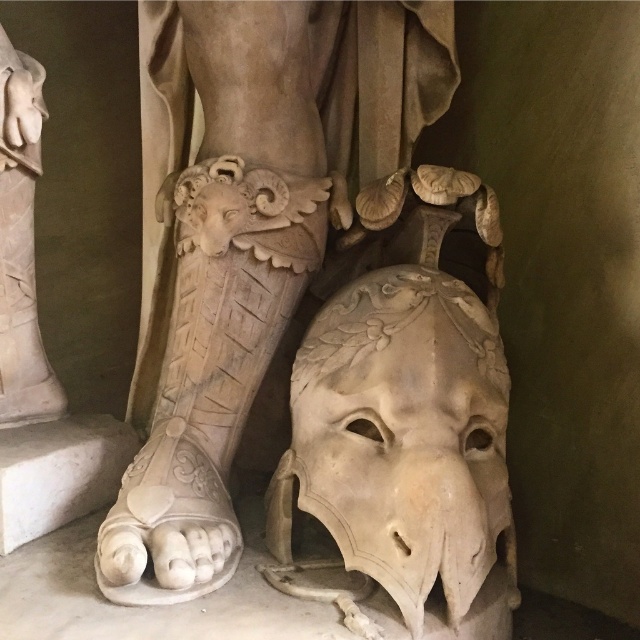
You are standing at the camera position looking at the classical marble sculpture. There is a point marked at coordinates point (401, 141) on the sculpture. If you want to touch this point with a 4.5 feet long stick, will the stick reach it?

The point (401, 141) is 4.42 feet away from the camera. Since the stick is 4.5 feet long, it can reach the point as it is slightly longer than the distance required.

You are an art conservator examining the classical marble sculpture. You notice two elements in the scene described as the point at coordinates (x=248, y=237) and the sandal with a ram head on the foot. Which of these elements is located closer to the bottom of the image?

The point at coordinates (x=248, y=237) indicates the white marble mask at lower center, which is closer to the bottom of the image compared to the sandal with a ram head on the foot.